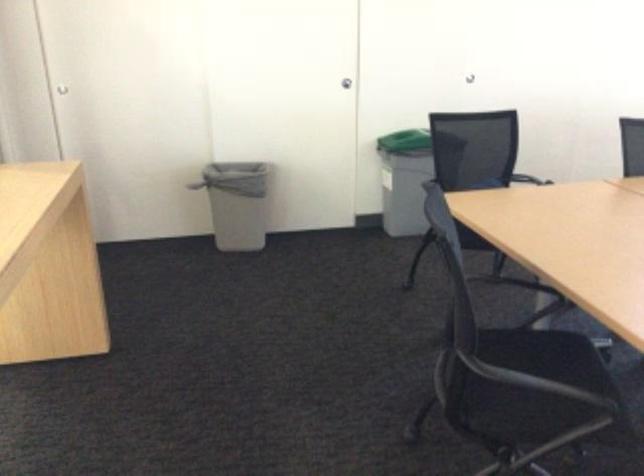
Find where to lift the green trash can lid. Please return your answer as a coordinate pair (x, y).

(404, 141)